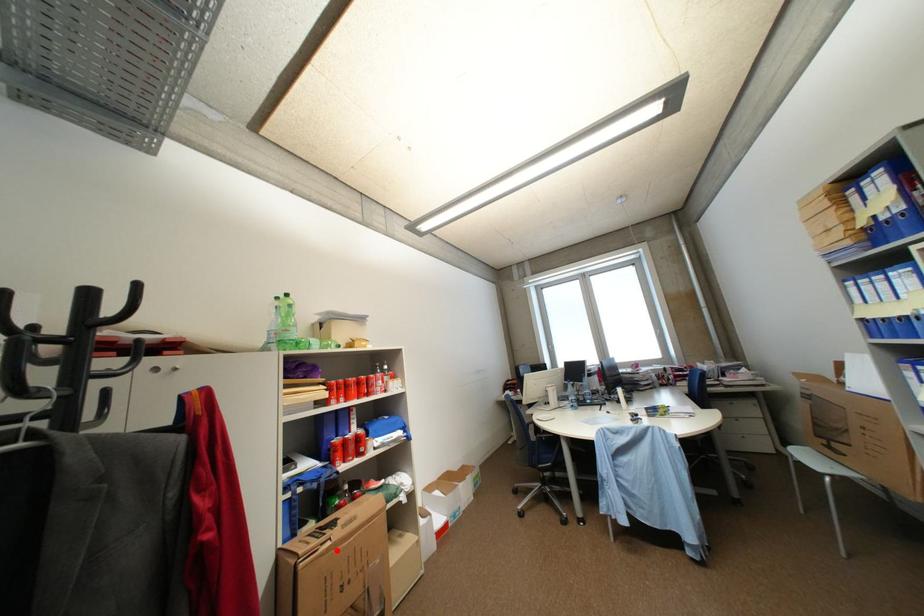
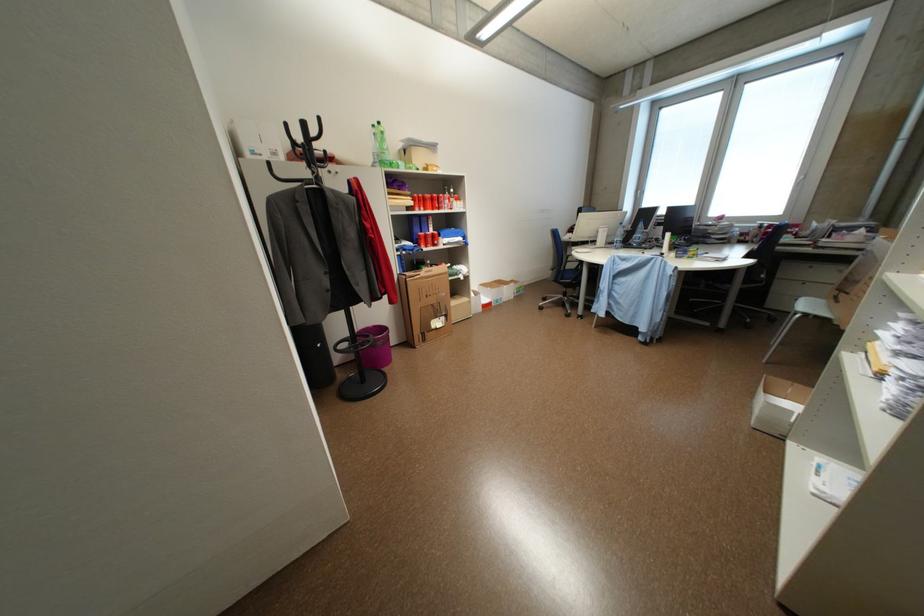
Find the pixel in the second image that matches the highlighted location in the first image.

(428, 280)